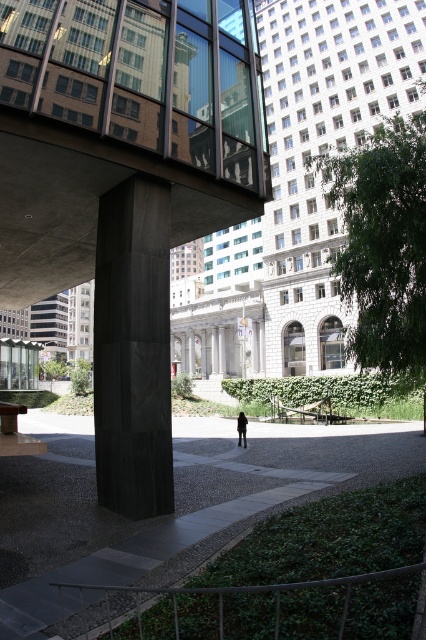
From the picture: You are a city planner assessing the space between the black polished stone column at center and the black leather jacket at center. If the jacket is 0.5 meters wide, what is the minimum width of the path required to accommodate both objects side by side?

The black polished stone column at center is wider than the black leather jacket at center. Since the jacket is 0.5 meters wide, the column must be wider than 0.5 meters. To accommodate both side by side, the path must be at least the sum of their widths. However, without knowing the exact width of the column, we can only state that the minimum path width required is greater than 1 meter.

Consider the image. You are a delivery person with a box that is 1.2 meters tall. You need to pass through the space between the smooth concrete path at center and the black polished stone column at center. Can your box fit vertically without tilting it?

The smooth concrete path at center is not as tall as the black polished stone column at center, but the height of the path itself isn t specified. Since the column is taller than the path, but the path s height is unknown, there isn t enough information to determine if the box will fit. You should measure the height of the path before proceeding.